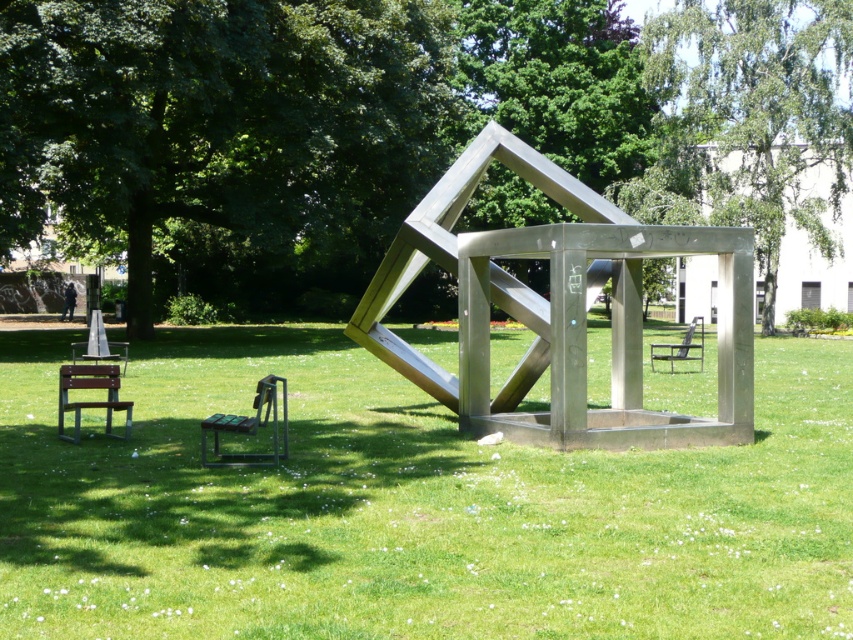
Question: Observing the image, what is the correct spatial positioning of green leafy tree at upper right in reference to metallic silver chair at center?

Choices:
 (A) above
 (B) below

Answer: (A)

Question: Does green grass at center appear over green leafy tree at upper right?

Choices:
 (A) no
 (B) yes

Answer: (A)

Question: Which object is positioned closest to the polished silver cube at center?

Choices:
 (A) wooden park bench at lower left
 (B) green leafy tree at upper right
 (C) green leafy tree at upper center
 (D) metallic silver chair at center

Answer: (A)

Question: Which object is closer to the camera taking this photo?

Choices:
 (A) green grass at center
 (B) wooden park bench at lower left
 (C) green metallic tree at center

Answer: (A)

Question: Does green metallic tree at center lie in front of green plastic chair at lower left?

Choices:
 (A) no
 (B) yes

Answer: (A)

Question: Among these objects, which one is nearest to the camera?

Choices:
 (A) wooden park bench at lower left
 (B) green grass at center
 (C) green leafy tree at upper right

Answer: (B)